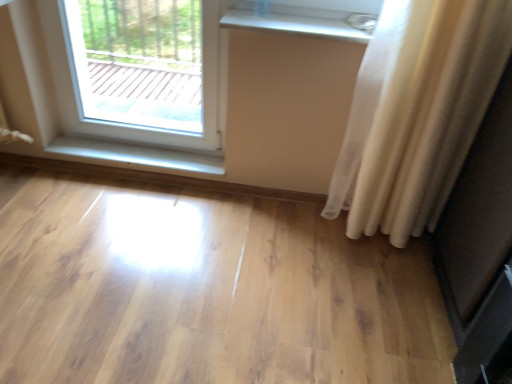
Identify the location of vacant region to the left of white sheer curtain at right. Image resolution: width=512 pixels, height=384 pixels. 290,239.